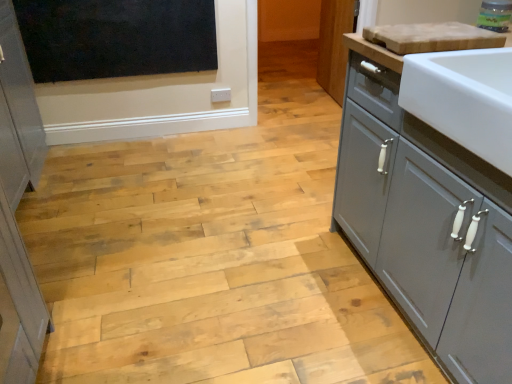
The image size is (512, 384). What are the coordinates of `empty space that is ontop of light brown wood cutting board at upper right (from a real-world perspective)` in the screenshot? It's located at (429, 28).